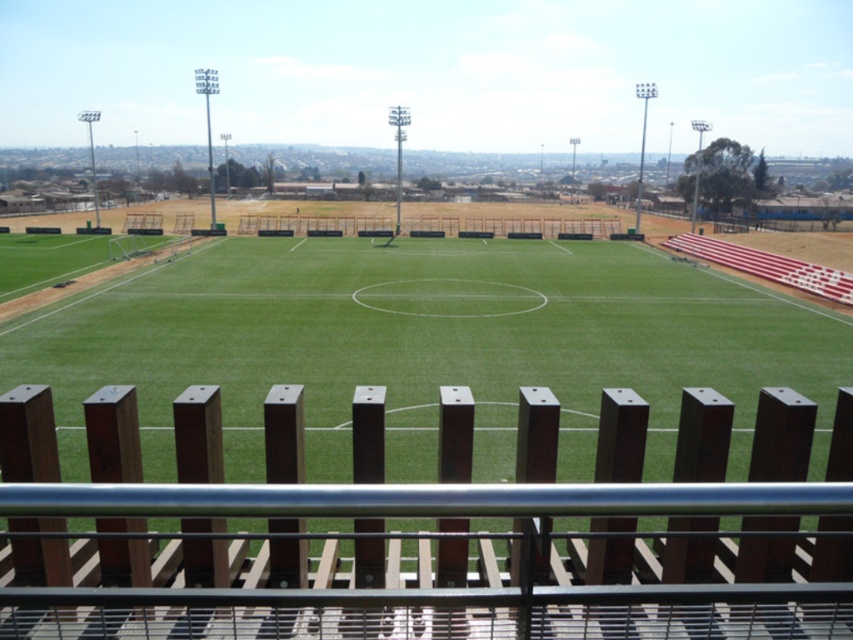
Question: Considering the relative positions of brown wooden fence at center and green grass football field at center in the image provided, where is brown wooden fence at center located with respect to green grass football field at center?

Choices:
 (A) above
 (B) below

Answer: (B)

Question: Is brown wooden fence at center bigger than green grass football field at center?

Choices:
 (A) yes
 (B) no

Answer: (B)

Question: Which point appears farthest from the camera in this image?

Choices:
 (A) (666, 260)
 (B) (450, 444)

Answer: (A)

Question: Which point appears closest to the camera in this image?

Choices:
 (A) (223, 637)
 (B) (602, 371)

Answer: (A)

Question: Which point is closer to the camera taking this photo?

Choices:
 (A) (210, 536)
 (B) (589, 387)

Answer: (A)

Question: Can you confirm if brown wooden fence at center is positioned to the right of green grass football field at center?

Choices:
 (A) yes
 (B) no

Answer: (A)